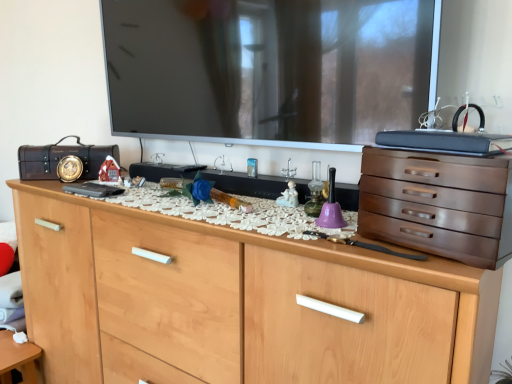
Question: Would you say satin brown chest of drawers at right, which is counted as the first chest of drawers, starting from the top, is to the left or to the right of white porcelain figurine at center in the picture?

Choices:
 (A) left
 (B) right

Answer: (B)

Question: Would you say satin brown chest of drawers at right, which is counted as the first chest of drawers, starting from the top, is inside or outside white porcelain figurine at center?

Choices:
 (A) outside
 (B) inside

Answer: (A)

Question: Based on their relative distances, which object is nearer to the white matte table at lower left?

Choices:
 (A) light wood chest of drawers at center, the first chest of drawers from the bottom
 (B) matte black suitcase at left
 (C) satin brown chest of drawers at right, which is counted as the 2th chest of drawers, starting from the bottom
 (D) white porcelain figurine at center

Answer: (A)

Question: Estimate the real-world distances between objects in this image. Which object is farther from the satin brown chest of drawers at right, which is counted as the first chest of drawers, starting from the top?

Choices:
 (A) white matte table at lower left
 (B) white porcelain figurine at center
 (C) light wood chest of drawers at center, the first chest of drawers from the bottom
 (D) matte black suitcase at left

Answer: (A)